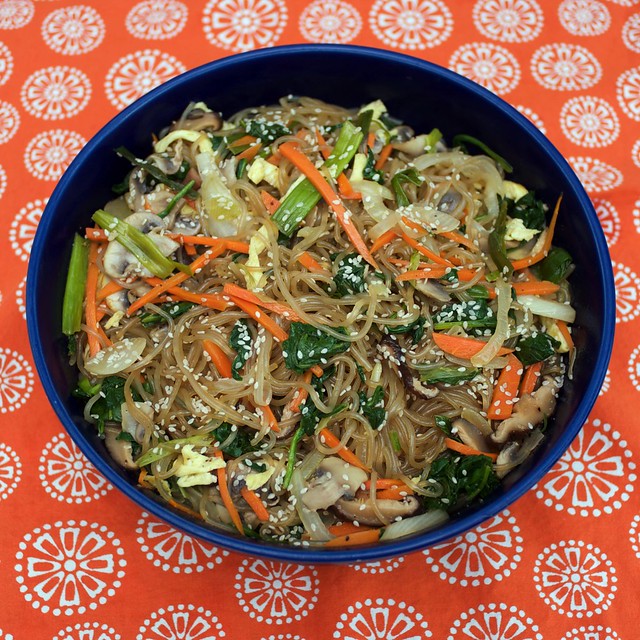
You are a GUI agent. You are given a task and a screenshot of the screen. Output one action in this format:
    pyautogui.click(x=<x>, y=<y>)
    Task: Click on the blue bowl
    The height and width of the screenshot is (640, 640).
    Given the screenshot: What is the action you would take?
    pyautogui.click(x=474, y=515)